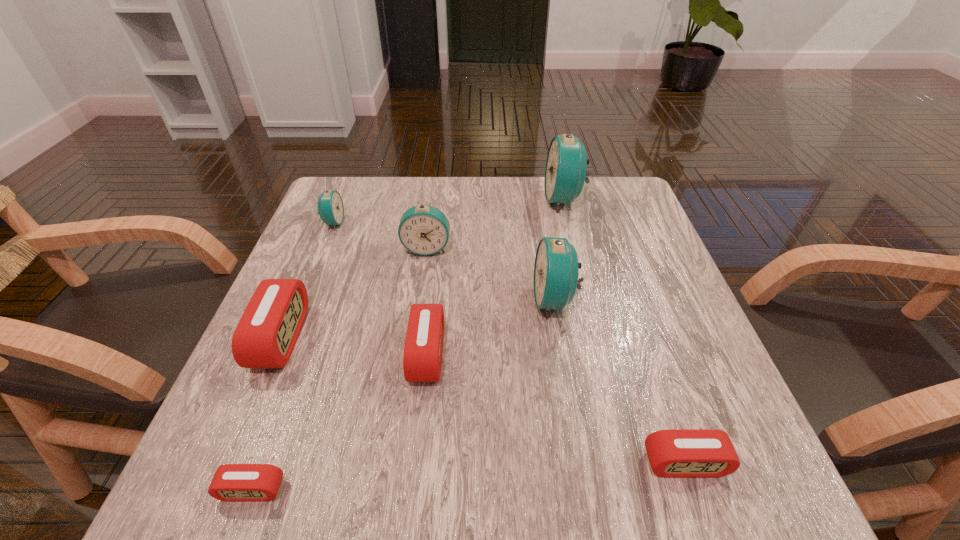
At what (x,y) coordinates should I click in order to perform the action: click on the third biggest pink alarm clock. Please return your answer as a coordinate pair (x, y). This screenshot has height=540, width=960. Looking at the image, I should click on (676, 453).

Image resolution: width=960 pixels, height=540 pixels. In order to click on the rightmost pink alarm clock in this screenshot , I will do [676, 453].

The height and width of the screenshot is (540, 960). Find the location of `the smallest pink alarm clock`. the smallest pink alarm clock is located at coordinates (232, 482).

The image size is (960, 540). I want to click on the shortest alarm clock, so click(x=232, y=482).

This screenshot has height=540, width=960. I want to click on vacant region located 0.400m on the front-facing side of the tallest object, so click(392, 200).

At what (x,y) coordinates should I click in order to perform the action: click on free space located 0.120m on the front-facing side of the tallest object. Please return your answer as a coordinate pair (x, y). This screenshot has width=960, height=540. Looking at the image, I should click on (498, 200).

At what (x,y) coordinates should I click in order to perform the action: click on vacant space located on the front-facing side of the tallest object. Please return your answer as a coordinate pair (x, y). The image size is (960, 540). Looking at the image, I should click on (521, 200).

Where is `free spot located 0.170m on the front-facing side of the nearest blue alarm clock`? This screenshot has width=960, height=540. free spot located 0.170m on the front-facing side of the nearest blue alarm clock is located at coordinates (449, 300).

At what (x,y) coordinates should I click in order to perform the action: click on free space located 0.070m on the front-facing side of the nearest blue alarm clock. Please return your answer as a coordinate pair (x, y). Image resolution: width=960 pixels, height=540 pixels. Looking at the image, I should click on (498, 300).

At what (x,y) coordinates should I click in order to perform the action: click on free space located 0.160m on the front-facing side of the nearest blue alarm clock. Please return your answer as a coordinate pair (x, y). The image size is (960, 540). Looking at the image, I should click on (454, 300).